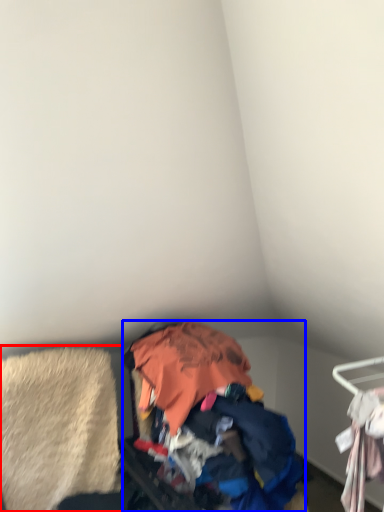
Question: Which point is further to the camera, clothing (highlighted by a red box) or garbage (highlighted by a blue box)?

Choices:
 (A) clothing
 (B) garbage

Answer: (A)